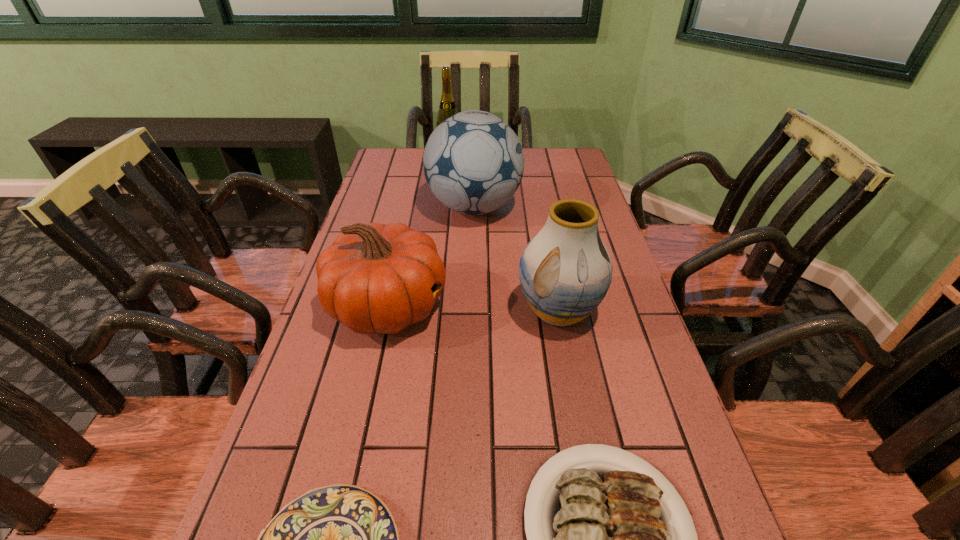
You are a GUI agent. You are given a task and a screenshot of the screen. Output one action in this format:
    pyautogui.click(x=<x>, y=<y>)
    Task: Click on the object present at the right edge
    
    Given the screenshot: What is the action you would take?
    pyautogui.click(x=565, y=271)

I want to click on free space at the left edge of the desktop, so click(320, 411).

The width and height of the screenshot is (960, 540). Identify the location of vacant position at the right edge of the desktop. (592, 350).

Locate an element on the screen. The width and height of the screenshot is (960, 540). free spot at the far left corner of the desktop is located at coordinates (390, 164).

Locate an element on the screen. The width and height of the screenshot is (960, 540). blank region between the farthest object and the vase is located at coordinates (504, 234).

You are a GUI agent. You are given a task and a screenshot of the screen. Output one action in this format:
    pyautogui.click(x=<x>, y=<y>)
    Task: Click on the vacant space in between the vase and the third shortest object
    The width and height of the screenshot is (960, 540).
    Given the screenshot: What is the action you would take?
    pyautogui.click(x=473, y=309)

Choose which object is the fourth nearest neighbor to the right plate. Please provide its 2D coordinates. Your answer should be formatted as a tuple, i.e. [(x, y)], where the tuple contains the x and y coordinates of a point satisfying the conditions above.

[(473, 162)]

Locate an element on the screen. object that can be found as the second closest to the pumpkin is located at coordinates (565, 271).

This screenshot has height=540, width=960. I want to click on free space that satisfies the following two spatial constraints: 1. on the back side of the vase; 2. on the face of the pumpkin, so click(x=558, y=306).

This screenshot has width=960, height=540. Identify the location of free location that satisfies the following two spatial constraints: 1. on the back side of the vase; 2. on the face of the third shortest object. (558, 306).